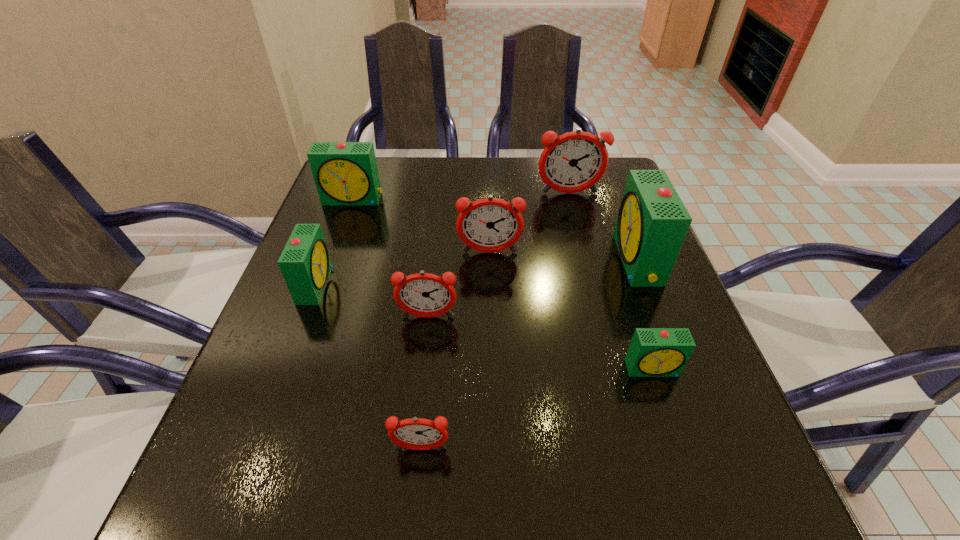
Locate which object is the seventh closest to the third smallest green alarm clock. Please provide its 2D coordinates. Your answer should be formatted as a tuple, i.e. [(x, y)], where the tuple contains the x and y coordinates of a point satisfying the conditions above.

[(653, 352)]

Identify the location of object that ranks as the fifth closest to the third nearest reddish-pink alarm clock. The image size is (960, 540). (305, 263).

You are a GUI agent. You are given a task and a screenshot of the screen. Output one action in this format:
    pyautogui.click(x=<x>, y=<y>)
    Task: Click on the alarm clock that is the second nearest to the second smallest green alarm clock
    
    Given the screenshot: What is the action you would take?
    pyautogui.click(x=345, y=173)

You are a GUI agent. You are given a task and a screenshot of the screen. Output one action in this format:
    pyautogui.click(x=<x>, y=<y>)
    Task: Click on the alarm clock that is the sixth nearest to the biggest green alarm clock
    
    Given the screenshot: What is the action you would take?
    pyautogui.click(x=345, y=173)

Locate an element on the screen. This screenshot has height=540, width=960. reddish-pink alarm clock that can be found as the third closest to the nearest reddish-pink alarm clock is located at coordinates (575, 161).

Where is `reddish-pink alarm clock that is the fourth closest to the farthest green alarm clock`? reddish-pink alarm clock that is the fourth closest to the farthest green alarm clock is located at coordinates (415, 433).

Where is `green alarm clock identified as the third closest to the biggest green alarm clock`? The height and width of the screenshot is (540, 960). green alarm clock identified as the third closest to the biggest green alarm clock is located at coordinates (305, 263).

Locate which green alarm clock ranks third in proximity to the second smallest green alarm clock. Please provide its 2D coordinates. Your answer should be formatted as a tuple, i.e. [(x, y)], where the tuple contains the x and y coordinates of a point satisfying the conditions above.

[(652, 223)]

Image resolution: width=960 pixels, height=540 pixels. I want to click on free space that satisfies the following two spatial constraints: 1. on the front-facing side of the biggest green alarm clock; 2. on the front-facing side of the nearest reddish-pink alarm clock, so click(x=709, y=449).

Locate an element on the screen. free location that satisfies the following two spatial constraints: 1. on the front-facing side of the biggest green alarm clock; 2. on the front-facing side of the nearest reddish-pink alarm clock is located at coordinates (709, 449).